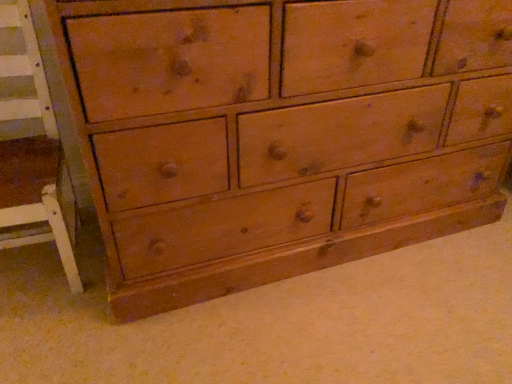
The image size is (512, 384). What do you see at coordinates (31, 147) in the screenshot? I see `white painted wood armchair at left` at bounding box center [31, 147].

The image size is (512, 384). Identify the location of white painted wood armchair at left. (31, 147).

The width and height of the screenshot is (512, 384). Identify the location of white painted wood armchair at left. (31, 147).